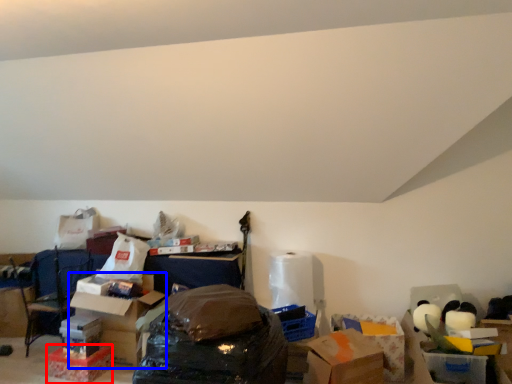
Question: Which of the following is the closest to the observer, storage box (highlighted by a red box) or cardboard box (highlighted by a blue box)?

Choices:
 (A) storage box
 (B) cardboard box

Answer: (A)